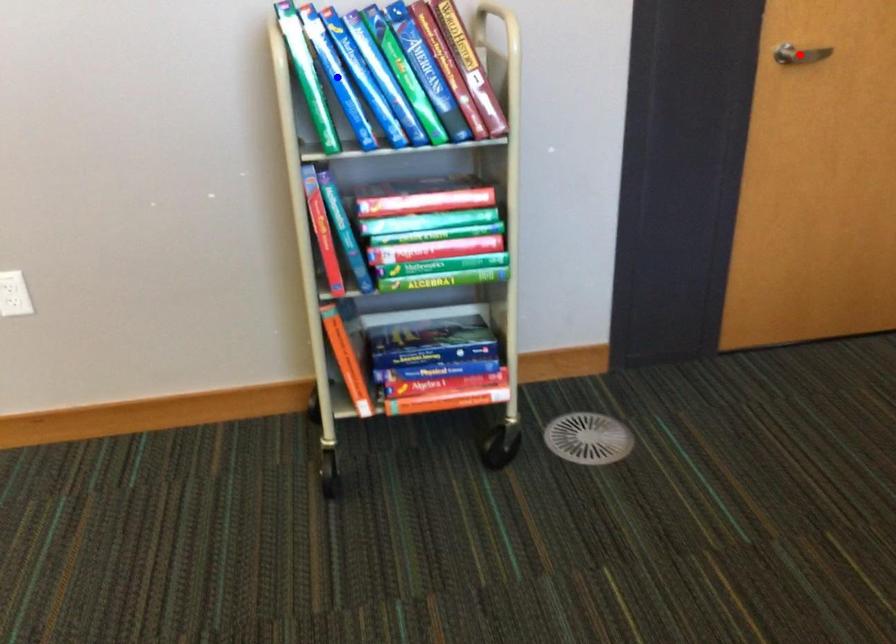
Question: In the image, two points are highlighted. Which point is nearer to the camera? Reply with the corresponding letter.

Choices:
 (A) blue point
 (B) red point

Answer: (A)